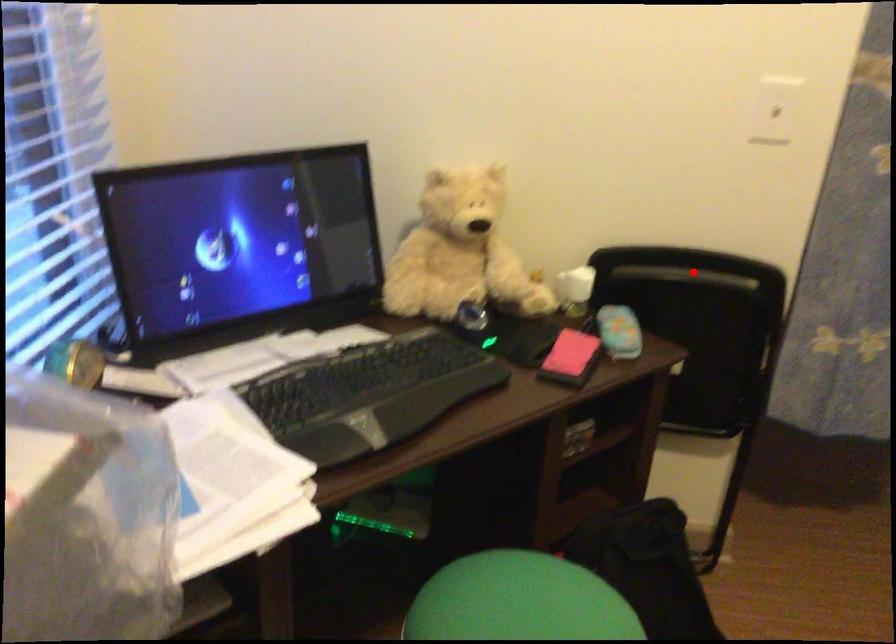
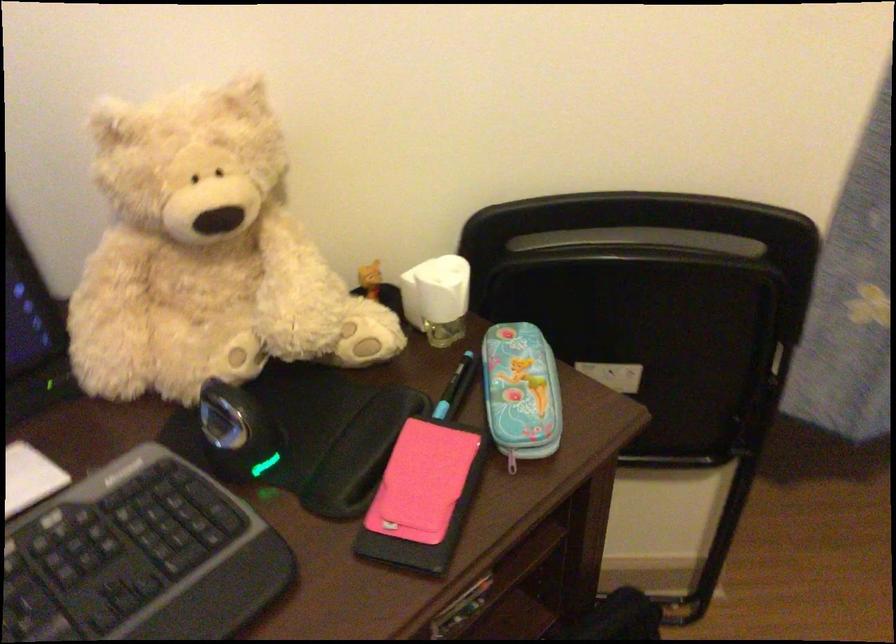
Question: I am providing you with two images of the same scene from different viewpoints. Image1 has a red point marked. In image2, the corresponding 3D location appears at what relative position? Reply with the corresponding letter.

Choices:
 (A) Closer
 (B) Farther

Answer: (A)